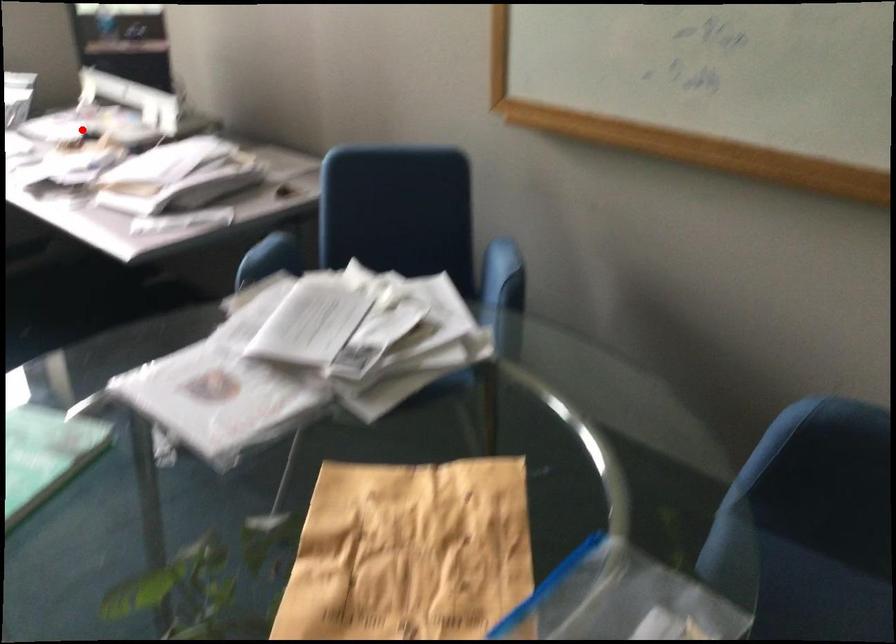
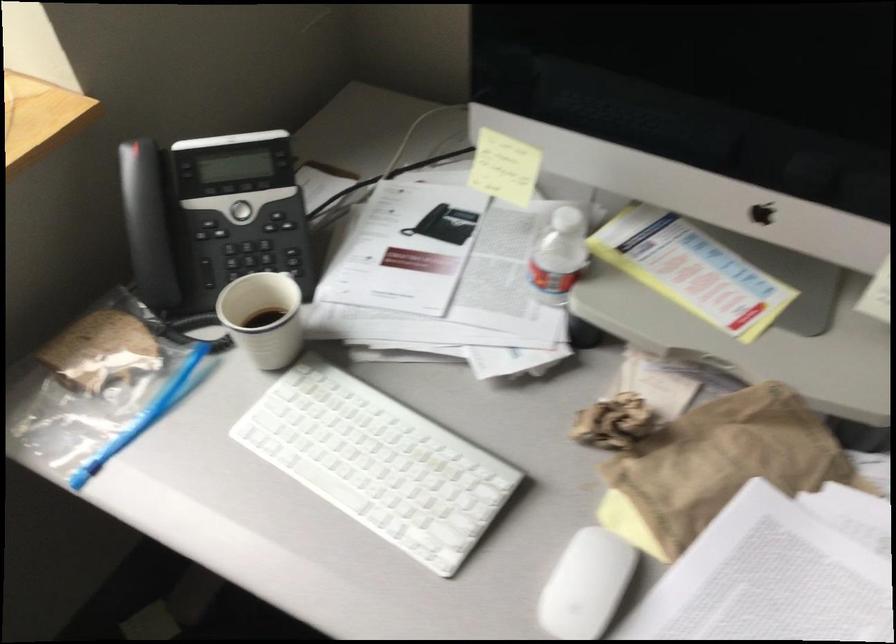
In the second image, find the point that corresponds to the highlighted location in the first image.

(718, 466)